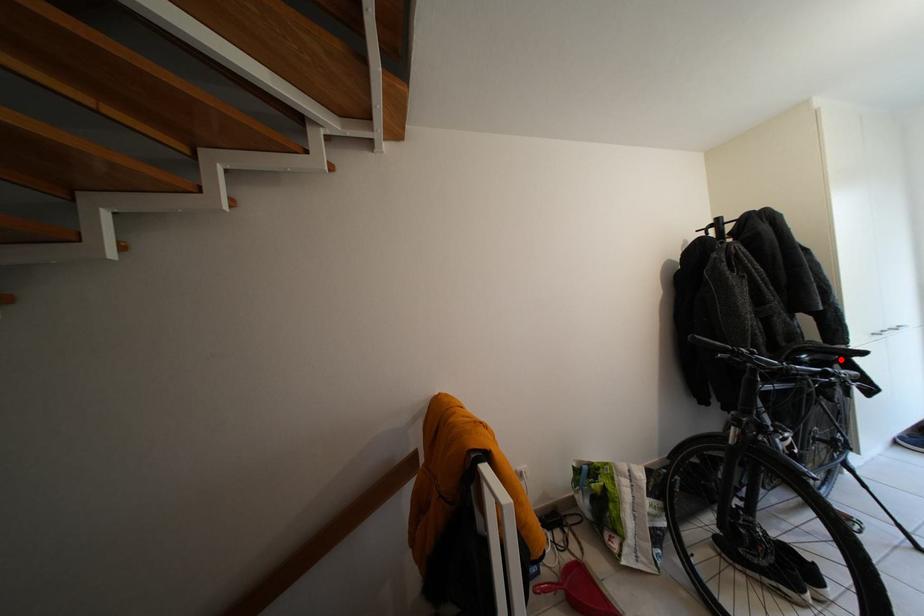
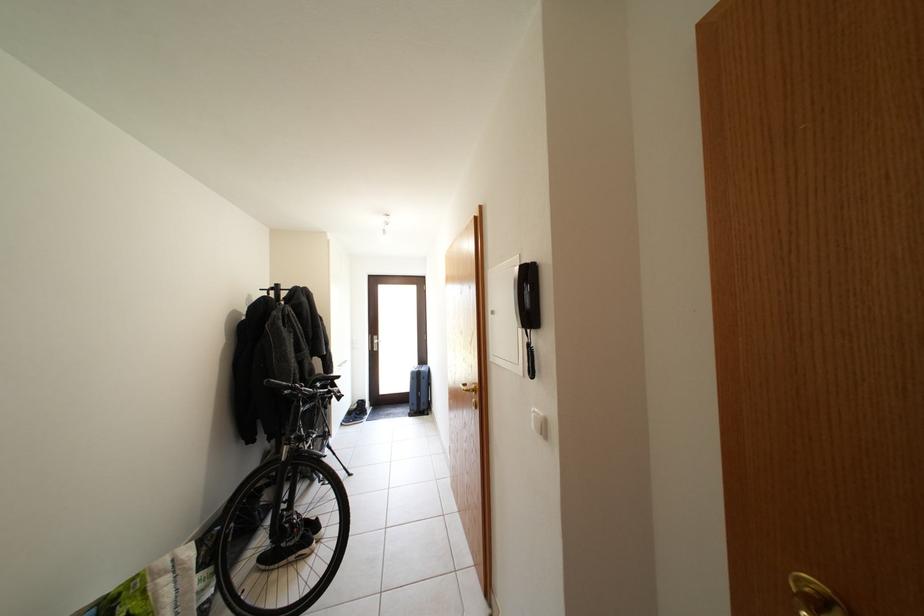
The point at the highlighted location is marked in the first image. Where is the corresponding point in the second image?

(336, 386)